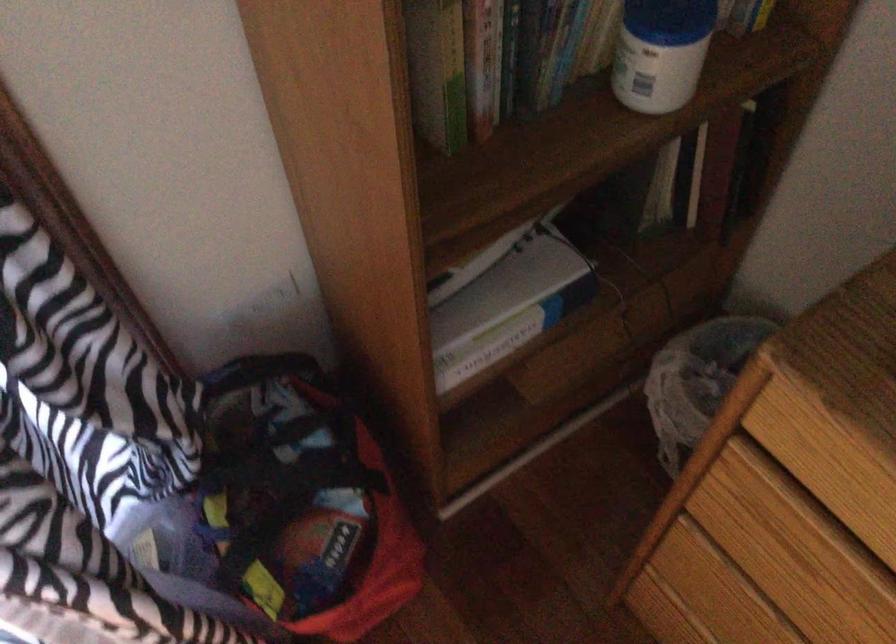
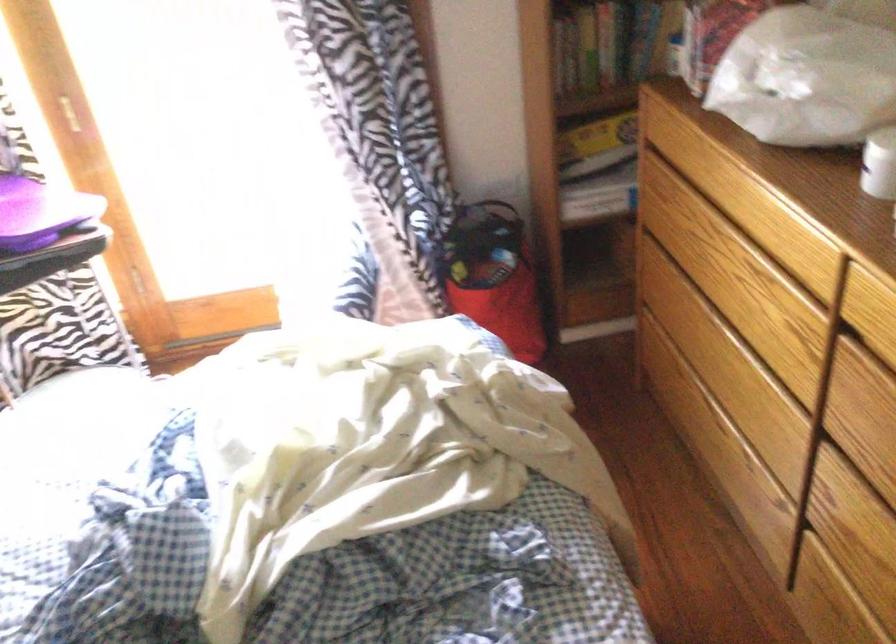
The point at (264, 353) is marked in the first image. Where is the corresponding point in the second image?

(493, 200)